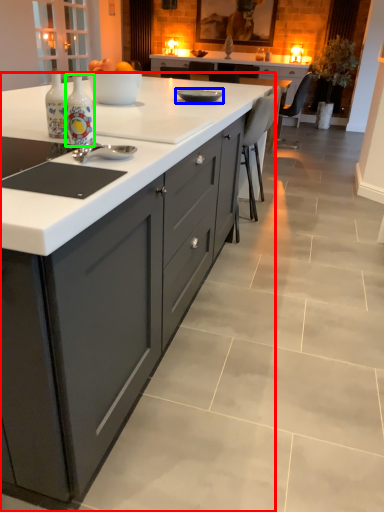
Question: Considering the real-world distances, which object is closest to cabinetry (highlighted by a red box)? kitchen appliance (highlighted by a blue box) or bottle (highlighted by a green box).

Choices:
 (A) kitchen appliance
 (B) bottle

Answer: (B)